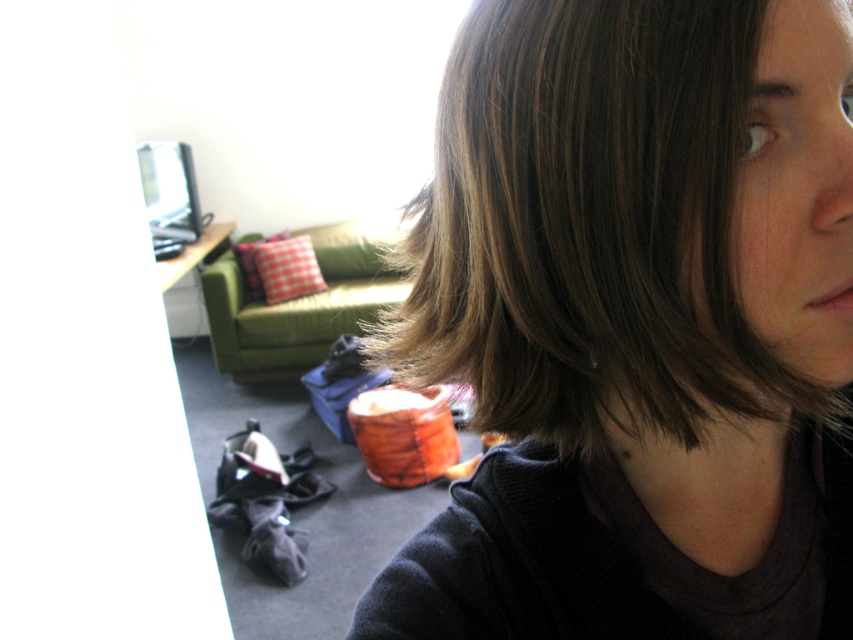
Looking at this image, you are a photographer trying to capture a portrait of the person with brown hair at center and the green fabric armchair at center. Based on their positions, which object should you focus on first to ensure both are in the frame?

The brown hair at center is located below the green fabric armchair at center, so you should focus on the green fabric armchair at center first to ensure both are in the frame.

Please provide the exact 2D coordinates of the brown hair at center in the image. The coordinates should be in the format of a point like this example format point format is like this example format is like this example format is like this example format is like this example format is like this example format is like this example format is like this example format is like this example format is like this example format is like this example format is like this example format is like this example format is

The exact 2D coordinates of the brown hair at center are at point (636, 324).